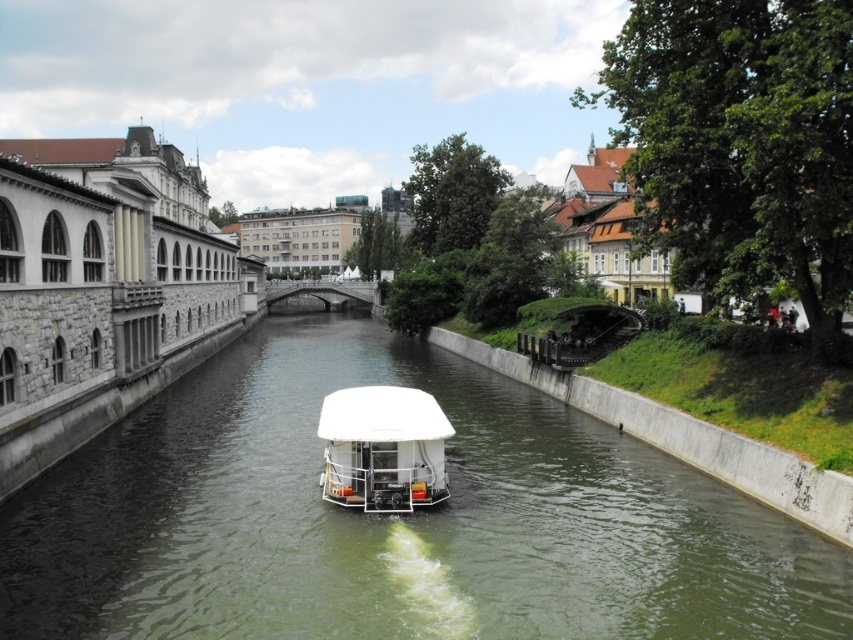
You are standing on the bank of the canal and want to board the white matte boat at center. Which direction should you walk to reach it from the green concrete river at center?

The green concrete river at center is below the white matte boat at center, so you should walk upwards towards the white matte boat at center to reach it.

You are a tour guide leading a group along the canal. You want to explain the layout of the scene. Which object is wider, the green concrete river at center or the white matte boat at center?

The green concrete river at center is wider than the white matte boat at center according to the description.